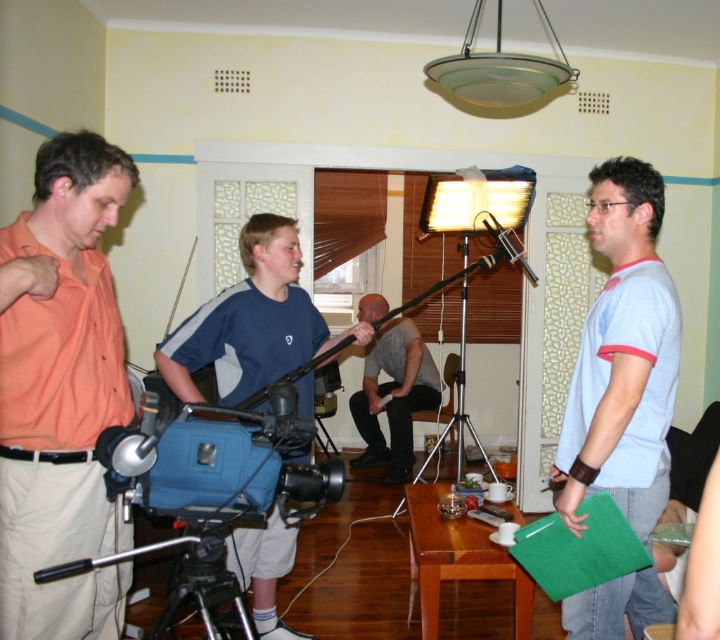
From the picture: Does gray cotton shirt at center have a greater height compared to silver metallic tripod at center?

In fact, gray cotton shirt at center may be shorter than silver metallic tripod at center.

Does gray cotton shirt at center lie in front of silver metallic tripod at center?

No, gray cotton shirt at center is behind silver metallic tripod at center.

Is point (396, 408) closer to camera compared to point (459, 436)?

No.

Locate an element on the screen. gray cotton shirt at center is located at coordinates (392, 397).

Does light blue t-shirt at right appear on the right side of silver metallic tripod at center?

Indeed, light blue t-shirt at right is positioned on the right side of silver metallic tripod at center.

In the scene shown: Can you confirm if light blue t-shirt at right is shorter than silver metallic tripod at center?

Yes, light blue t-shirt at right is shorter than silver metallic tripod at center.

Is point (576, 480) farther from viewer compared to point (464, 272)?

That is False.

At what (x,y) coordinates should I click in order to perform the action: click on light blue t-shirt at right. Please return your answer as a coordinate pair (x, y). This screenshot has height=640, width=720. Looking at the image, I should click on (621, 358).

Measure the distance from orange cotton shirt at left to silver metallic tripod at center.

They are 8.50 feet apart.

Who is more distant from viewer, (96, 586) or (458, 275)?

Point (458, 275)

Describe the element at coordinates (60, 392) in the screenshot. I see `orange cotton shirt at left` at that location.

Locate an element on the screen. orange cotton shirt at left is located at coordinates (60, 392).